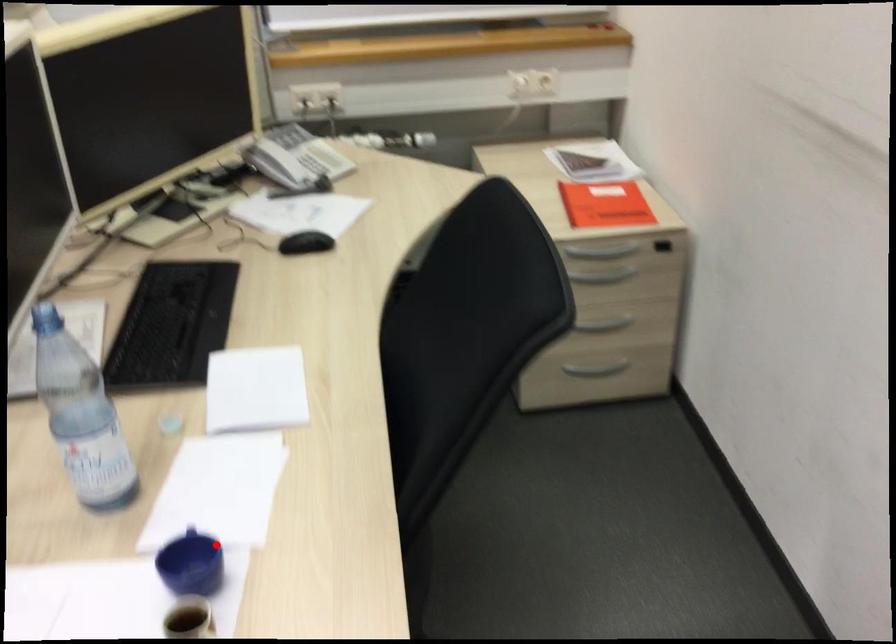
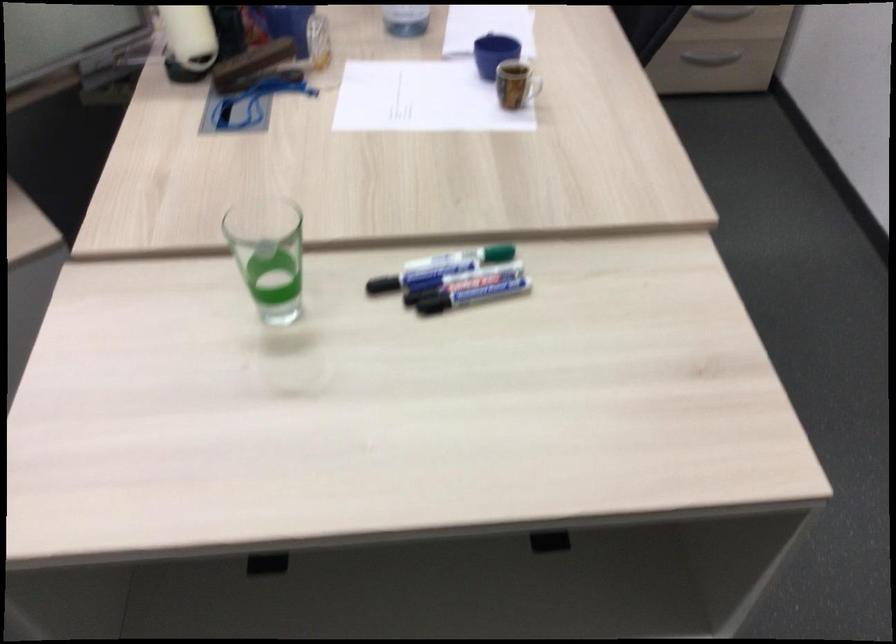
Question: A red point is marked in image1. In image2, is the corresponding 3D point closer to the camera or farther? Reply with the corresponding letter.

Choices:
 (A) The corresponding 3D point is closer.
 (B) The corresponding 3D point is farther.

Answer: (B)